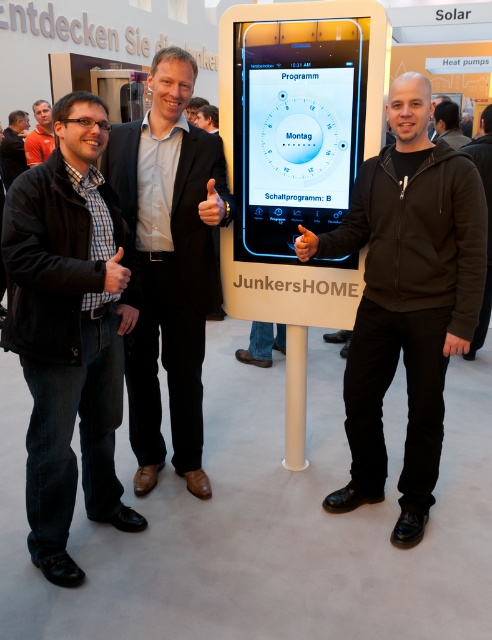
Question: Is black matte jacket at center wider than matte black suit at center?

Choices:
 (A) no
 (B) yes

Answer: (B)

Question: Does black matte jacket at center have a lesser width compared to black matte jacket at upper right?

Choices:
 (A) yes
 (B) no

Answer: (B)

Question: Which point is closer to the camera taking this photo?

Choices:
 (A) (165, 109)
 (B) (12, 176)

Answer: (A)

Question: Is brown fuzzy jacket at right to the right of black matte jacket at upper right from the viewer's perspective?

Choices:
 (A) yes
 (B) no

Answer: (A)

Question: Which of the following is the closest to the observer?

Choices:
 (A) (19, 172)
 (B) (164, 321)

Answer: (B)

Question: Which point is closer to the camera?

Choices:
 (A) black matte jacket at left
 (B) orange shirt at upper left
 (C) matte black suit at center
 (D) black matte jacket at center

Answer: (A)